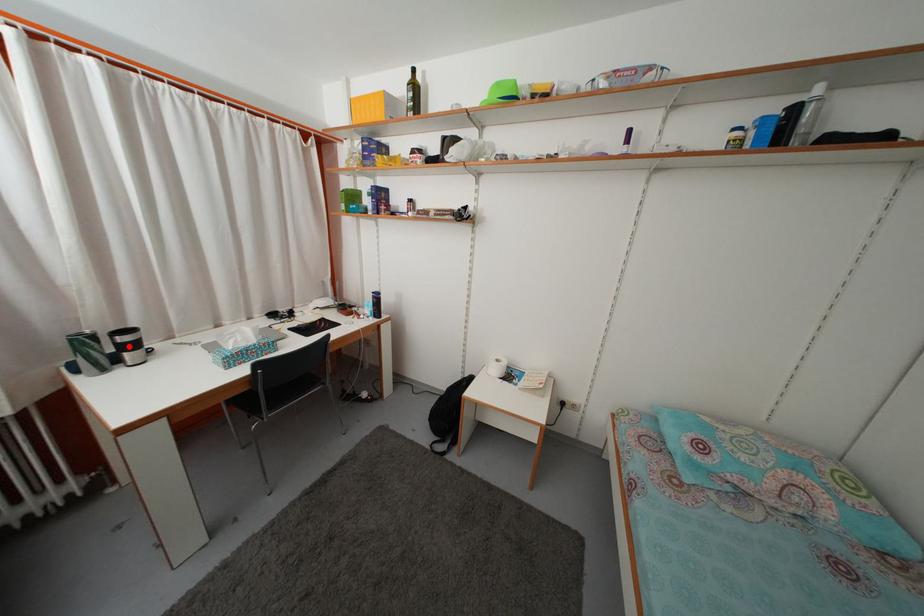
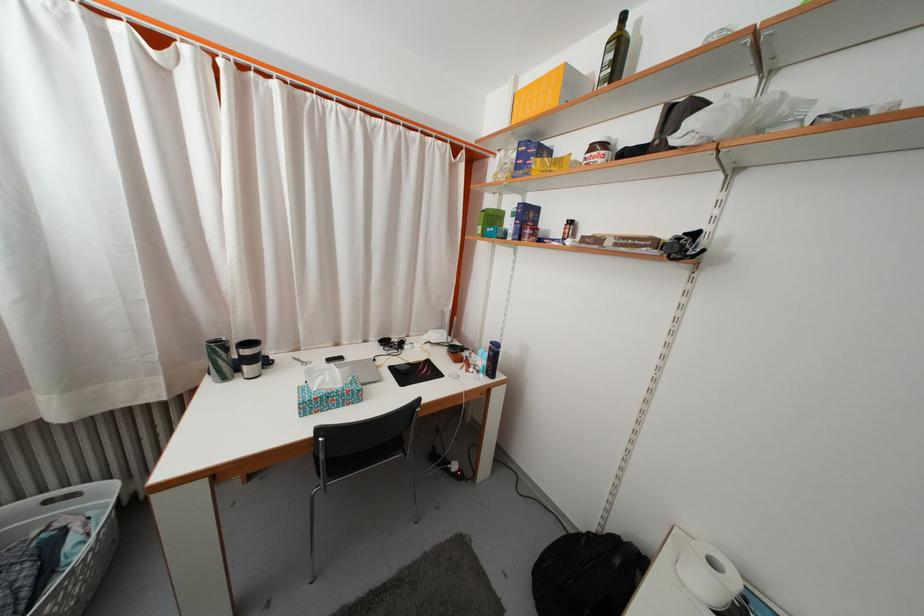
Question: I am providing you with two images of the same scene from different viewpoints. Image1 has a red point marked. In image2, the corresponding 3D location appears at what relative position? Reply with the corresponding letter.

Choices:
 (A) Closer
 (B) Farther

Answer: (A)